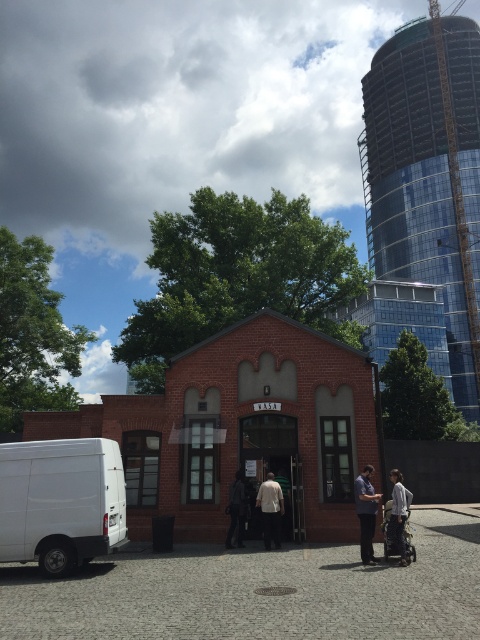
You are a photographer trying to capture both the blue cotton shirt at center and the light beige fabric shirt at center in a single shot. Which one should you focus on first to ensure both are in frame?

The blue cotton shirt at center is above the light beige fabric shirt at center, so you should focus on the blue cotton shirt at center first to ensure both are in frame.